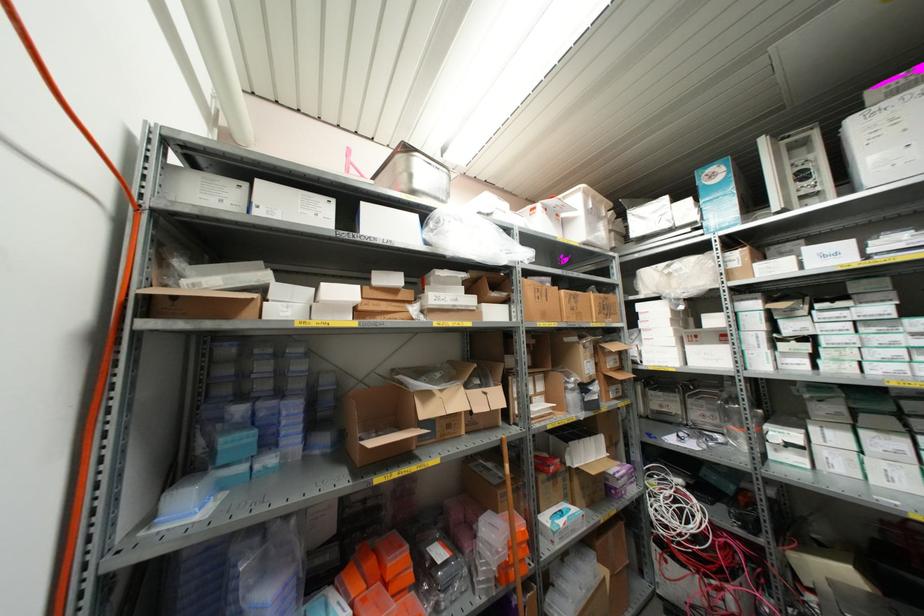
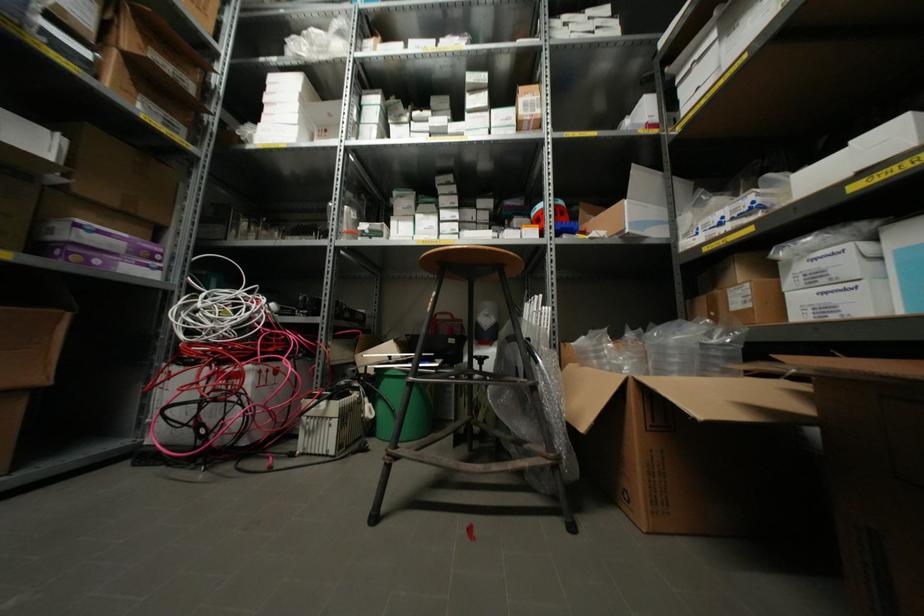
Locate, in the second image, the point that corresponds to (x=638, y=306) in the first image.

(272, 79)